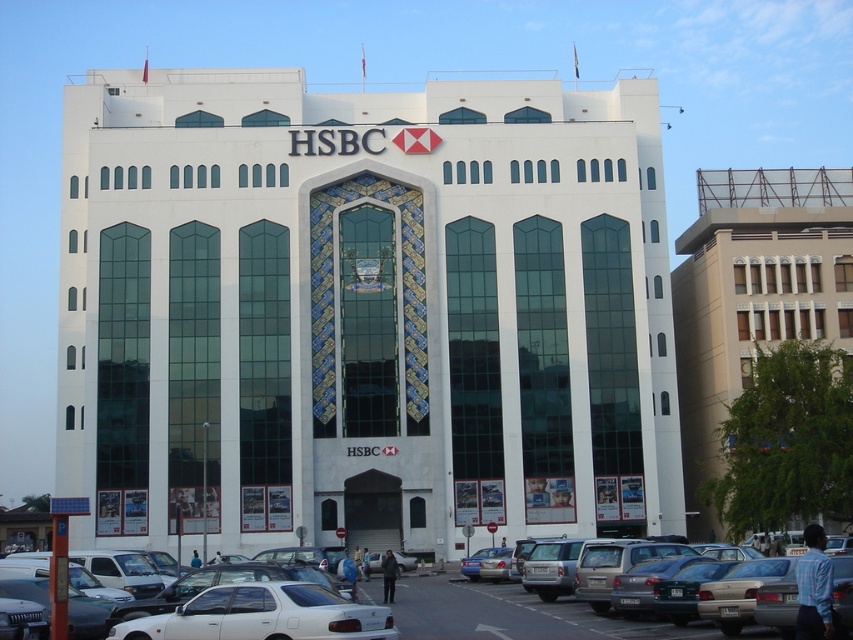
Question: Is the position of white matte cars at lower center less distant than that of silver metallic sedan at lower center?

Choices:
 (A) no
 (B) yes

Answer: (B)

Question: Does white matte cars at lower center appear on the left side of silver metallic sedan at lower center?

Choices:
 (A) no
 (B) yes

Answer: (B)

Question: Which point appears closest to the camera in this image?

Choices:
 (A) (268, 609)
 (B) (352, 596)
 (C) (476, 586)

Answer: (A)

Question: Can you confirm if white glossy sedan at center is wider than silver metallic sedan at lower center?

Choices:
 (A) no
 (B) yes

Answer: (A)

Question: Which is nearer to the white matte cars at lower center?

Choices:
 (A) silver metallic sedan at lower center
 (B) white glossy sedan at center
 (C) white matte sedan at lower center

Answer: (A)

Question: Which object appears closest to the camera in this image?

Choices:
 (A) silver metallic sedan at lower center
 (B) white glossy sedan at center
 (C) white matte sedan at lower center

Answer: (B)